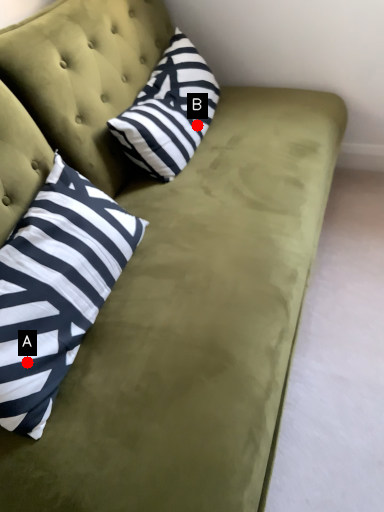
Question: Two points are circled on the image, labeled by A and B beside each circle. Which point appears farthest from the camera in this image?

Choices:
 (A) A is further
 (B) B is further

Answer: (B)